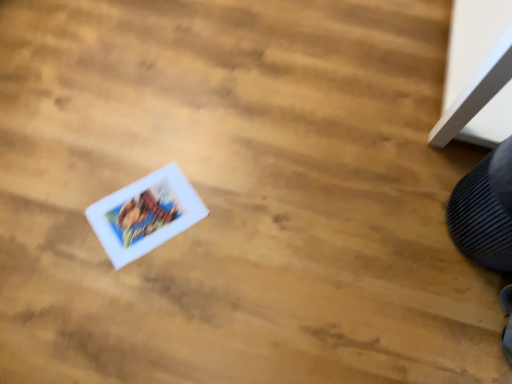
Question: From the image's perspective, is black textured shoe at lower right above or below white matte comic book at center?

Choices:
 (A) below
 (B) above

Answer: (B)

Question: Looking at their shapes, would you say black textured shoe at lower right is wider or thinner than white matte comic book at center?

Choices:
 (A) wide
 (B) thin

Answer: (B)

Question: Would you say black textured shoe at lower right is to the left or to the right of white matte comic book at center in the picture?

Choices:
 (A) right
 (B) left

Answer: (A)

Question: From the image's perspective, is white matte comic book at center above or below black textured shoe at lower right?

Choices:
 (A) below
 (B) above

Answer: (A)

Question: In terms of size, does white matte comic book at center appear bigger or smaller than black textured shoe at lower right?

Choices:
 (A) small
 (B) big

Answer: (A)

Question: Choose the correct answer: Is white matte comic book at center inside black textured shoe at lower right or outside it?

Choices:
 (A) outside
 (B) inside

Answer: (A)

Question: From a real-world perspective, is white matte comic book at center positioned above or below black textured shoe at lower right?

Choices:
 (A) above
 (B) below

Answer: (B)